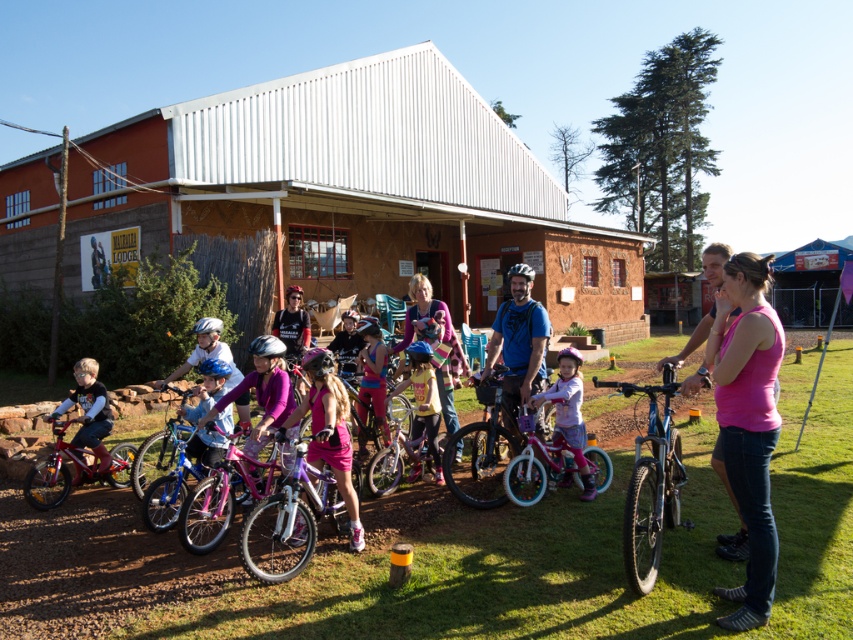
Which is above, pink matte bicycle at center or matte black shirt at left?

pink matte bicycle at center is above.

Locate an element on the screen. This screenshot has width=853, height=640. pink matte bicycle at center is located at coordinates (569, 413).

Between purple matte bicycle at center and shiny pink bicycle at center, which one is positioned lower?

purple matte bicycle at center is below.

Is purple matte bicycle at center shorter than shiny pink bicycle at center?

In fact, purple matte bicycle at center may be taller than shiny pink bicycle at center.

Who is more forward, (x=277, y=516) or (x=538, y=476)?

Positioned in front is point (x=277, y=516).

This screenshot has height=640, width=853. Find the location of `purple matte bicycle at center`. purple matte bicycle at center is located at coordinates (286, 524).

Can you confirm if pink metallic bicycle at center is positioned below pink fabric shirt at center?

Indeed, pink metallic bicycle at center is positioned under pink fabric shirt at center.

Is pink metallic bicycle at center above pink fabric shirt at center?

No.

The height and width of the screenshot is (640, 853). Identify the location of pink metallic bicycle at center. (222, 499).